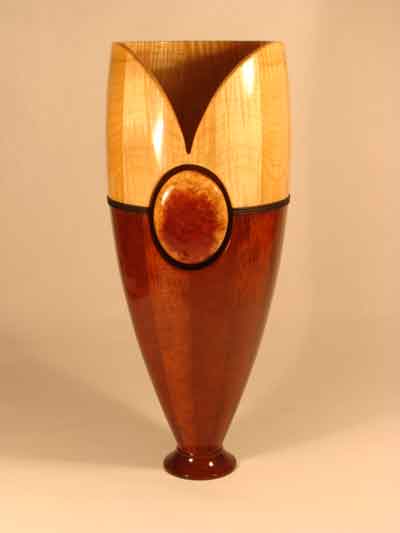
I want to click on inside of vase, so click(x=193, y=92).